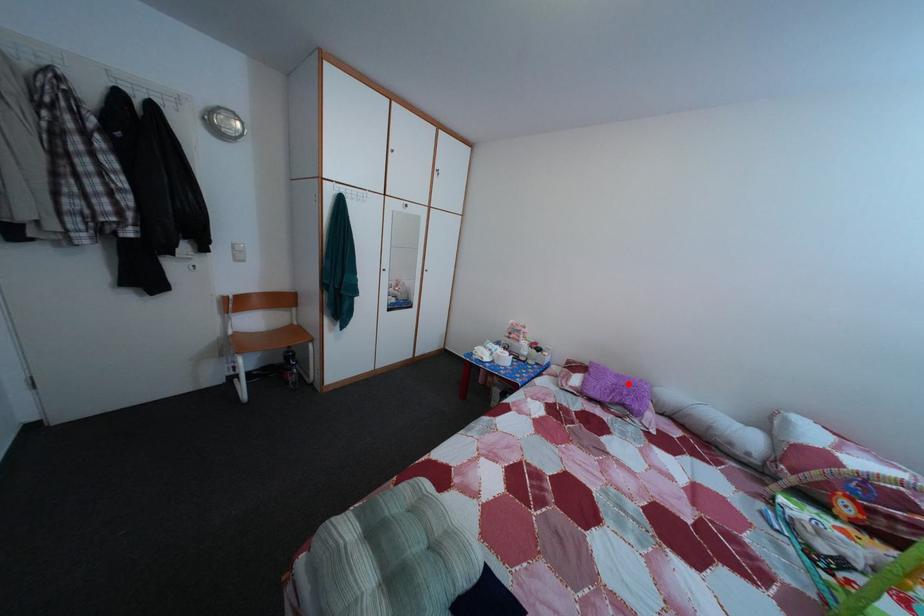
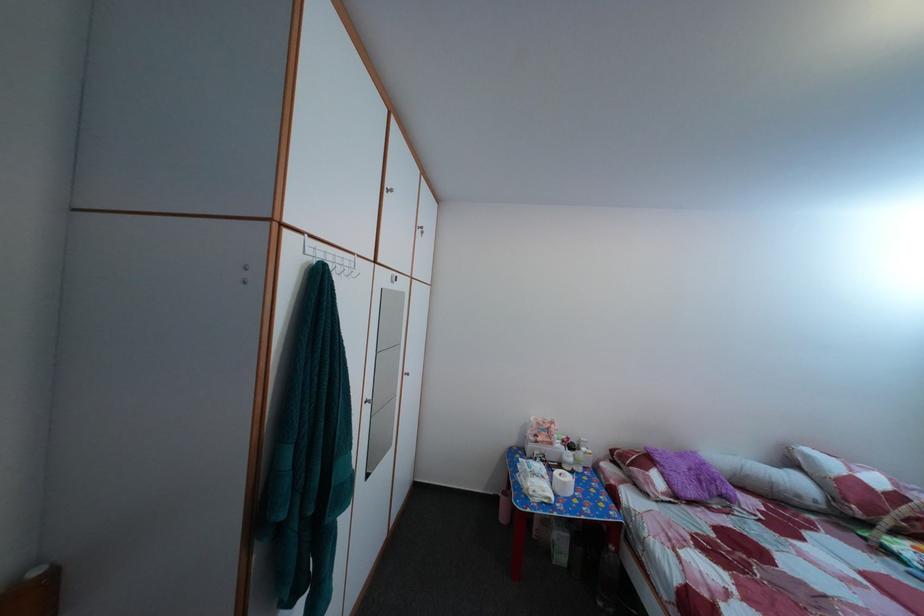
Find the pixel in the second image that matches the highlighted location in the first image.

(689, 464)